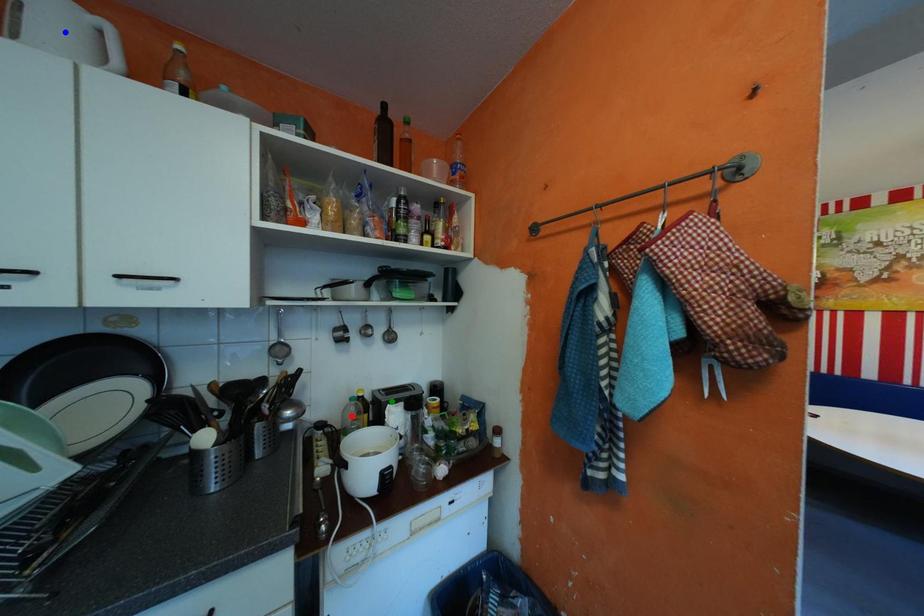
Order these from nearest to farthest:
1. green point
2. blue point
3. red point

blue point → green point → red point